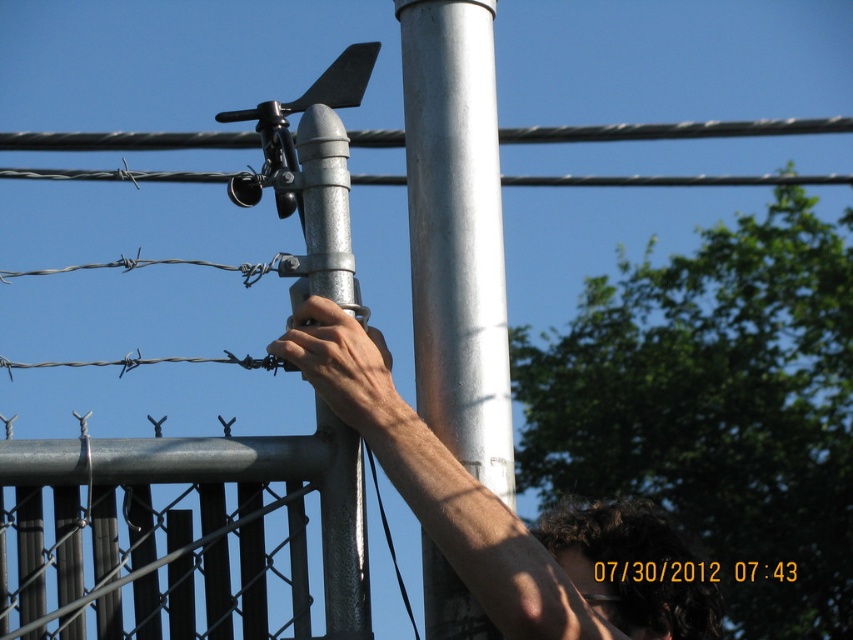
Question: Among these points, which one is nearest to the camera?

Choices:
 (A) (498, 564)
 (B) (335, 404)
 (C) (459, 280)
 (D) (303, 154)

Answer: (A)

Question: Based on their relative distances, which object is farther from the silver metallic pole at center?

Choices:
 (A) hair at upper center
 (B) galvanized metal pipe at center

Answer: (A)

Question: Is galvanized metal pipe at center behind smooth metallic hand at center?

Choices:
 (A) yes
 (B) no

Answer: (A)

Question: Is silver metallic pole at center below hair at upper center?

Choices:
 (A) no
 (B) yes

Answer: (A)

Question: Where is hair at upper center located in relation to smooth metallic hand at center in the image?

Choices:
 (A) right
 (B) left

Answer: (A)

Question: Which object is positioned farthest from the hair at upper center?

Choices:
 (A) smooth metallic hand at center
 (B) silver metallic pole at center

Answer: (B)